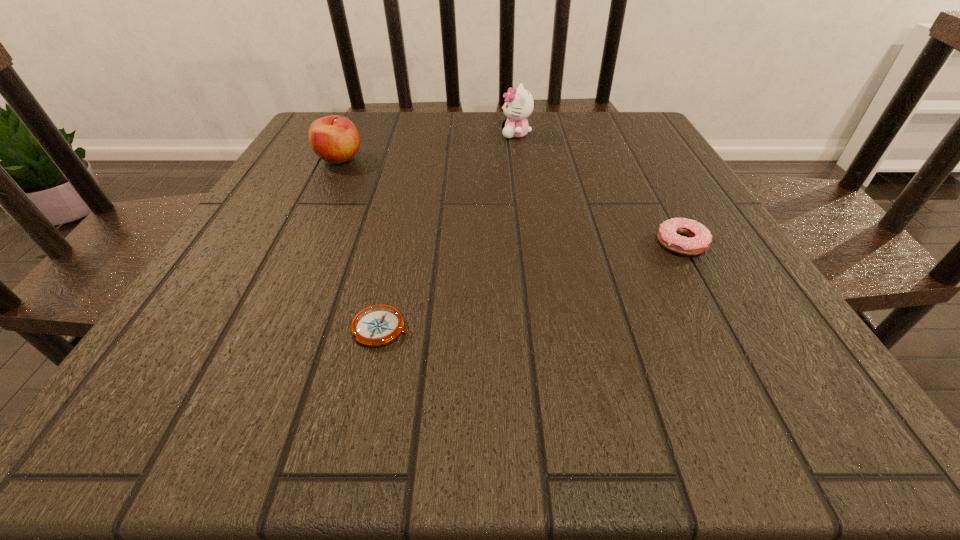
Where is `free space located on the front-facing side of the kitten`? This screenshot has height=540, width=960. free space located on the front-facing side of the kitten is located at coordinates (448, 134).

At what (x,y) coordinates should I click in order to perform the action: click on blank space located on the right of the second tallest object. Please return your answer as a coordinate pair (x, y). Looking at the image, I should click on (430, 159).

This screenshot has width=960, height=540. I want to click on free space located 0.100m on the back of the third farthest object, so click(657, 199).

The height and width of the screenshot is (540, 960). Find the location of `blank space located on the back of the compass`. blank space located on the back of the compass is located at coordinates (393, 281).

This screenshot has height=540, width=960. I want to click on kitten that is at the far edge, so click(519, 103).

You are a GUI agent. You are given a task and a screenshot of the screen. Output one action in this format:
    pyautogui.click(x=<x>, y=<y>)
    Task: Click on the apple located in the far edge section of the desktop
    The width and height of the screenshot is (960, 540).
    Given the screenshot: What is the action you would take?
    pyautogui.click(x=335, y=139)

The width and height of the screenshot is (960, 540). Identify the location of object at the left edge. (335, 139).

The image size is (960, 540). I want to click on object positioned at the right edge, so click(700, 238).

Identify the location of object situated at the far left corner. (335, 139).

The height and width of the screenshot is (540, 960). What are the coordinates of `free region at the far edge of the desktop` in the screenshot? It's located at (417, 137).